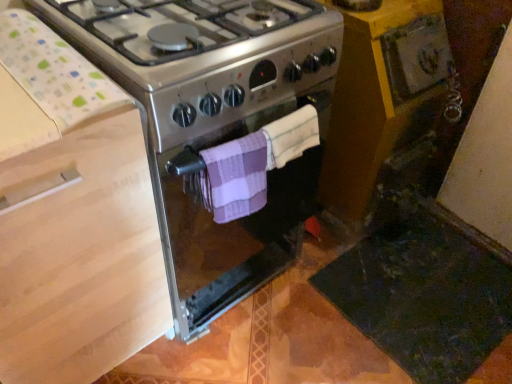
Question: In terms of width, does purple checkered towel at center, which is counted as the 2th towel/napkin, starting from the right, look wider or thinner when compared to yellow wood cabinet at lower right?

Choices:
 (A) wide
 (B) thin

Answer: (B)

Question: Do you think purple checkered towel at center, which is counted as the 2th towel/napkin, starting from the right, is within yellow wood cabinet at lower right, or outside of it?

Choices:
 (A) inside
 (B) outside

Answer: (B)

Question: Which object is positioned farthest from the satin silver gas stove at center?

Choices:
 (A) purple checkered towel at center, arranged as the 2th towel/napkin when viewed from the left
 (B) wooden at left
 (C) yellow wood cabinet at lower right
 (D) purple checkered towel at center, which is counted as the 2th towel/napkin, starting from the right

Answer: (C)

Question: Considering the real-world distances, which object is farthest from the purple checkered towel at center, which ranks as the first towel/napkin in right-to-left order?

Choices:
 (A) yellow wood cabinet at lower right
 (B) satin silver gas stove at center
 (C) purple checkered towel at center, positioned as the 1th towel/napkin in left-to-right order
 (D) wooden at left

Answer: (D)